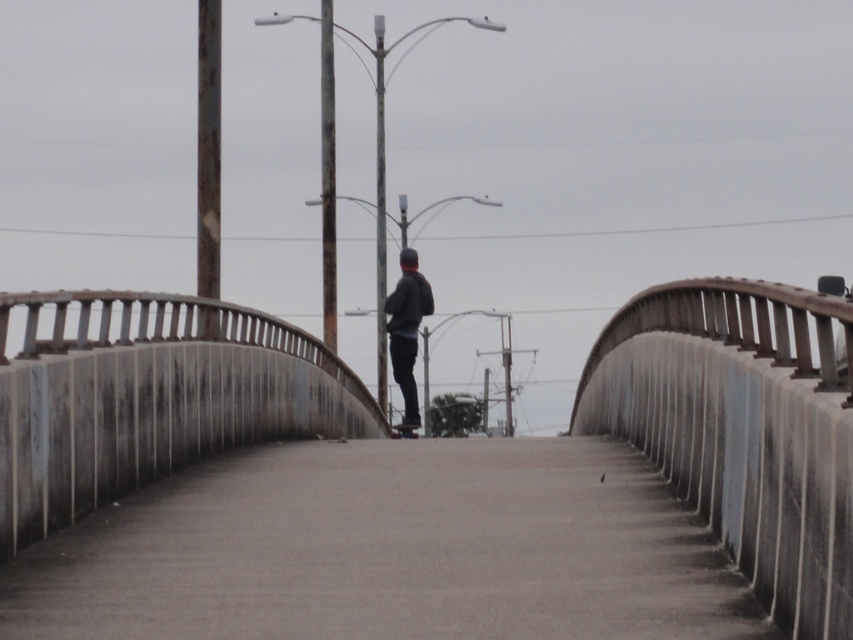
Question: Estimate the real-world distances between objects in this image. Which object is farther from the dark gray sweater at center?

Choices:
 (A) smooth concrete path at center
 (B) smooth concrete railing at center

Answer: (A)

Question: Which is nearer to the dark gray matte skateboard at center?

Choices:
 (A) dark gray sweater at center
 (B) smooth concrete path at center

Answer: (A)

Question: Is dark gray sweater at center positioned at the back of dark gray matte skateboard at center?

Choices:
 (A) yes
 (B) no

Answer: (B)

Question: Can you confirm if smooth concrete railing at center is positioned to the left of dark gray sweater at center?

Choices:
 (A) no
 (B) yes

Answer: (A)

Question: Observing the image, what is the correct spatial positioning of smooth concrete path at center in reference to dark gray sweater at center?

Choices:
 (A) right
 (B) left

Answer: (A)

Question: Which object is positioned closest to the smooth concrete railing at center?

Choices:
 (A) dark gray matte skateboard at center
 (B) dark gray sweater at center

Answer: (B)